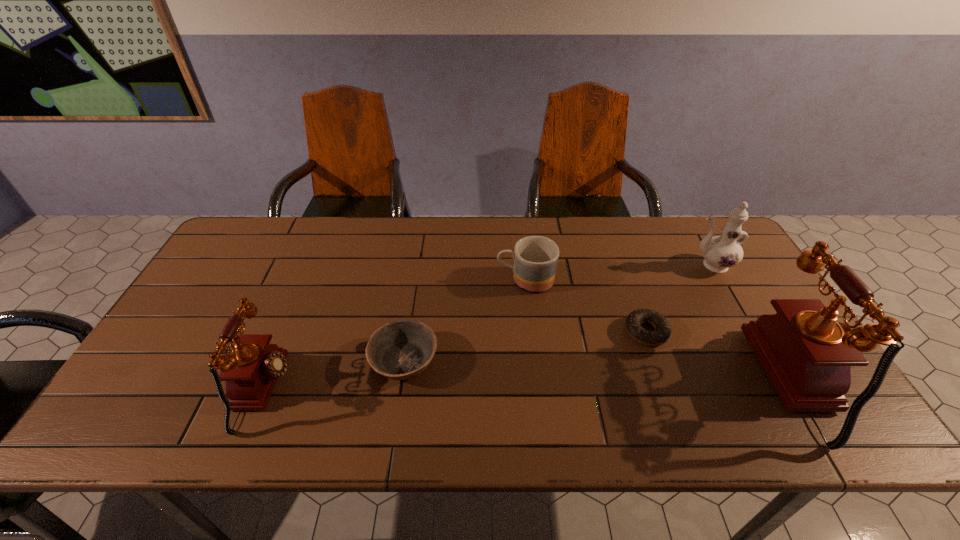
Where is `object identified as the fifth closest to the bowl`? The image size is (960, 540). object identified as the fifth closest to the bowl is located at coordinates (807, 355).

Where is `vacant position in the image that satisfies the following two spatial constraints: 1. at the spout of the chinaware; 2. on the front side of the shortest object`? The image size is (960, 540). vacant position in the image that satisfies the following two spatial constraints: 1. at the spout of the chinaware; 2. on the front side of the shortest object is located at coordinates (749, 332).

I want to click on vacant space that satisfies the following two spatial constraints: 1. on the side with the handle of the mug; 2. on the front side of the bowl, so click(x=535, y=361).

Where is `free space that satisfies the following two spatial constraints: 1. on the back side of the fifth object from right to left; 2. on the right side of the doughnut`? This screenshot has width=960, height=540. free space that satisfies the following two spatial constraints: 1. on the back side of the fifth object from right to left; 2. on the right side of the doughnut is located at coordinates pyautogui.click(x=409, y=332).